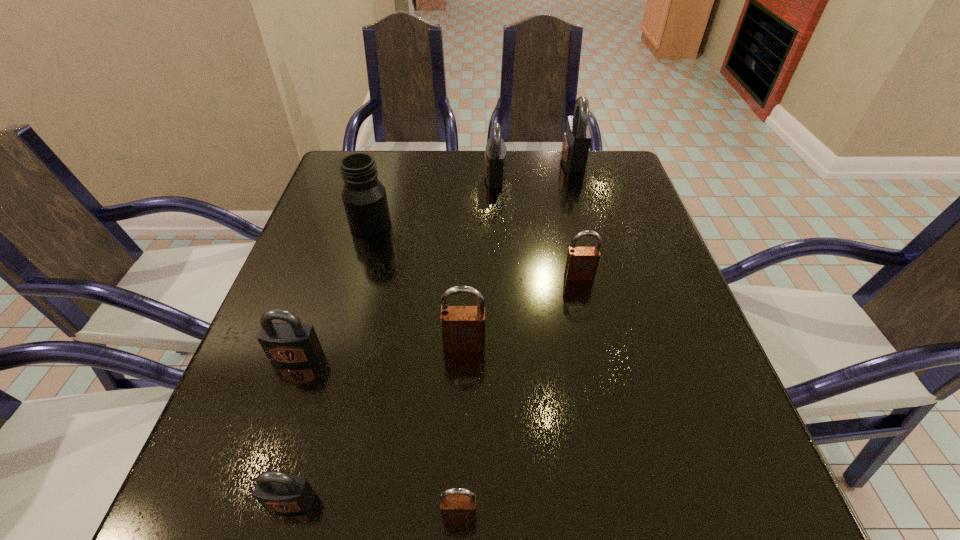
Where is `the smallest brown padlock`? the smallest brown padlock is located at coordinates click(x=458, y=505).

At what (x,y) coordinates should I click in order to perform the action: click on vacant space situated 0.120m on the front of the tallest padlock near the keyhole. Please return your answer as a coordinate pair (x, y). Looking at the image, I should click on tap(518, 160).

You are a GUI agent. You are given a task and a screenshot of the screen. Output one action in this format:
    pyautogui.click(x=<x>, y=<y>)
    Task: Click on the free space located on the front of the tallest padlock near the keyhole
    
    Given the screenshot: What is the action you would take?
    pyautogui.click(x=493, y=160)

Where is `free spot located on the front of the tallest padlock near the keyhole`? This screenshot has height=540, width=960. free spot located on the front of the tallest padlock near the keyhole is located at coordinates (472, 160).

Identify the location of free region located on the front of the jar. (356, 275).

What are the coordinates of `vacant space located 0.330m on the front of the third gray padlock from left to right near the keyhole` in the screenshot? It's located at (361, 177).

This screenshot has height=540, width=960. I want to click on free region located 0.230m on the front of the third gray padlock from left to right near the keyhole, so click(x=398, y=177).

Where is `free point located 0.170m on the front of the third gray padlock from left to right near the keyhole`? This screenshot has height=540, width=960. free point located 0.170m on the front of the third gray padlock from left to right near the keyhole is located at coordinates (421, 177).

You are a GUI agent. You are given a task and a screenshot of the screen. Output one action in this format:
    pyautogui.click(x=<x>, y=<y>)
    Task: Click on the free point located 0.230m on the front-facing side of the second farthest brown padlock
    
    Given the screenshot: What is the action you would take?
    pyautogui.click(x=460, y=487)

What are the coordinates of `vacant space located on the front-facing side of the fifth nearest padlock` in the screenshot? It's located at (590, 326).